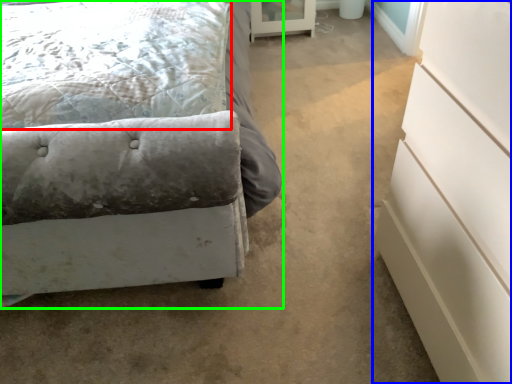
Question: Estimate the real-world distances between objects in this image. Which object is farther from pillow (highlighted by a red box), chest of drawers (highlighted by a blue box) or bed (highlighted by a green box)?

Choices:
 (A) chest of drawers
 (B) bed

Answer: (A)